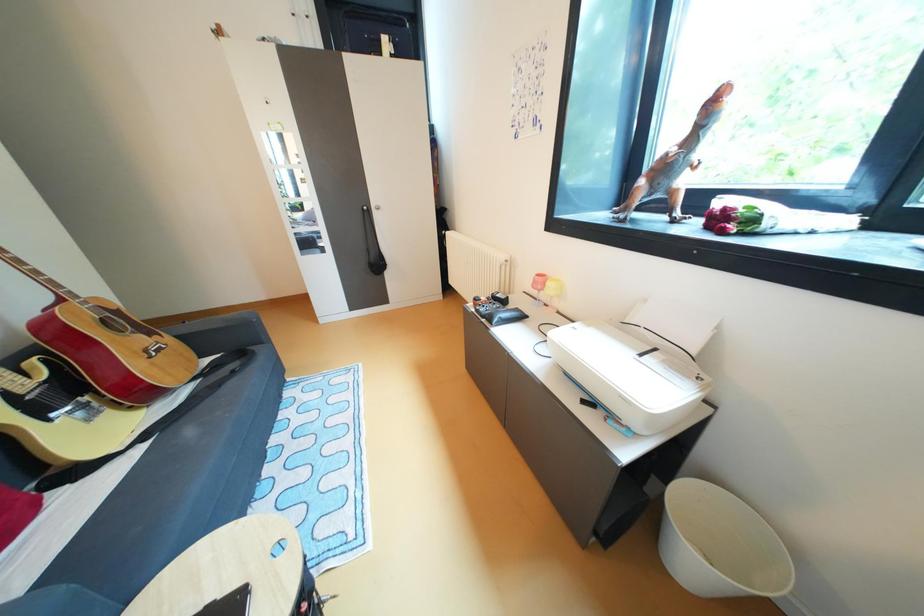
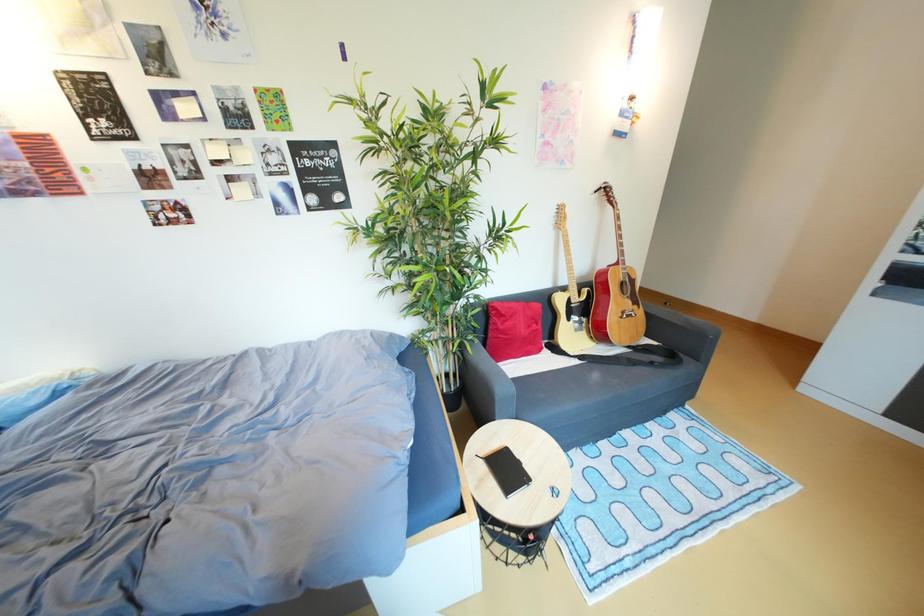
How did the camera likely rotate?

The camera rotated toward left-down.